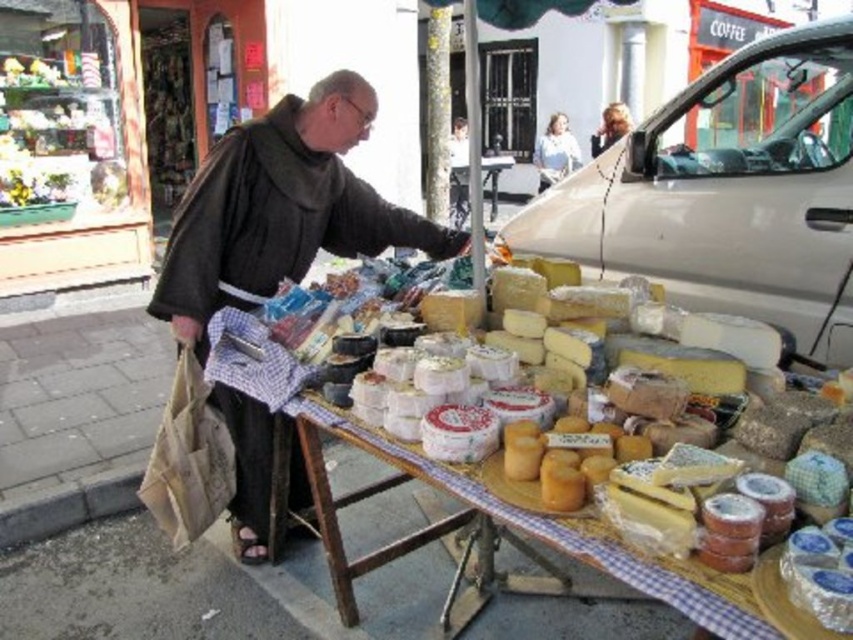
You are a customer at the cheese stall and want to pick up the cheese located at point (195, 243) and point (495, 202). Which cheese will be easier to reach without moving your position?

The cheese located at point (195, 243) will be easier to reach because it is closer to you than the cheese at point (495, 202).

You are standing at the origin point of the image. Where is the dark brown woolen robe at center located in terms of coordinates?

The dark brown woolen robe at center is located at coordinates point (281, 209).